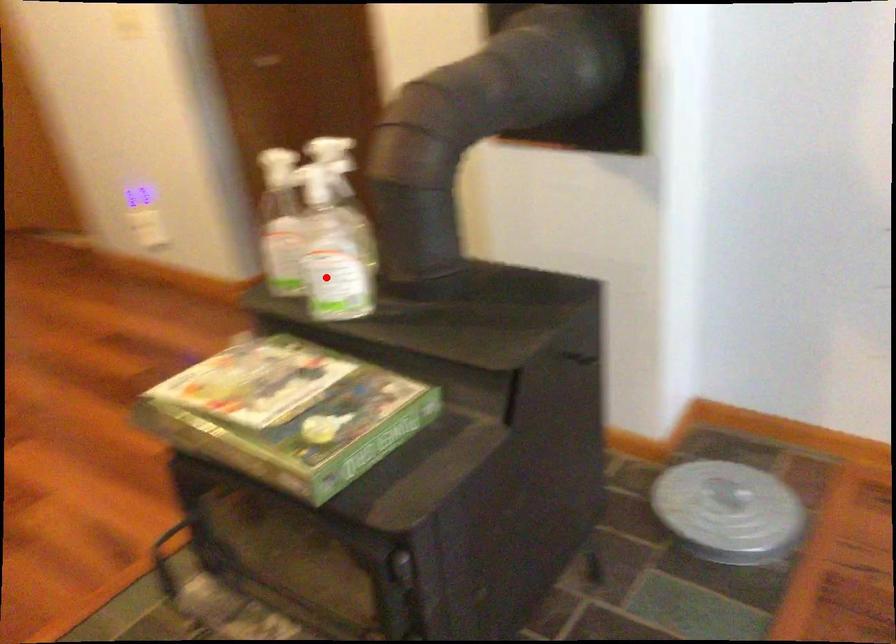
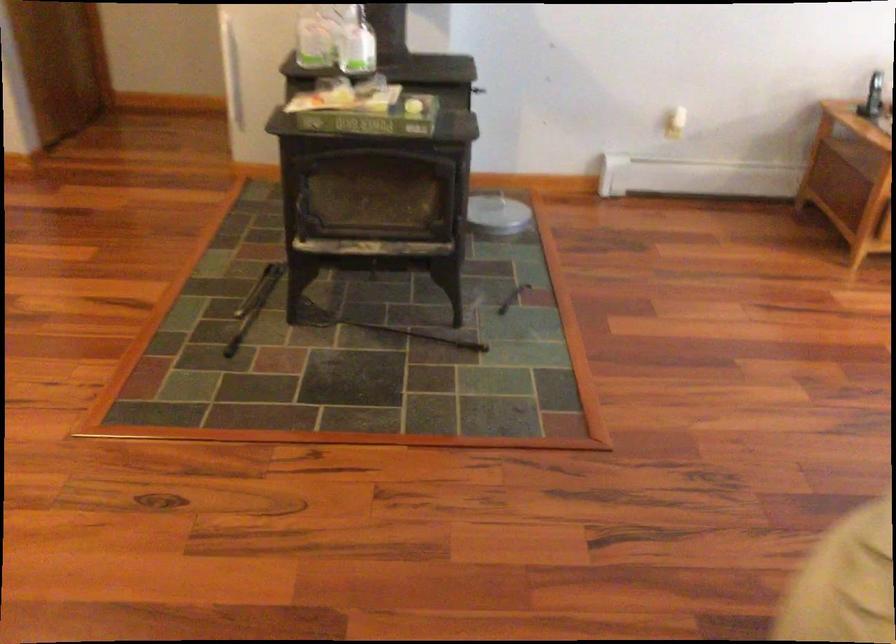
Question: I am providing you with two images of the same scene from different viewpoints. Image1 has a red point marked. In image2, the corresponding 3D location appears at what relative position? Reply with the corresponding letter.

Choices:
 (A) Closer
 (B) Farther

Answer: (B)